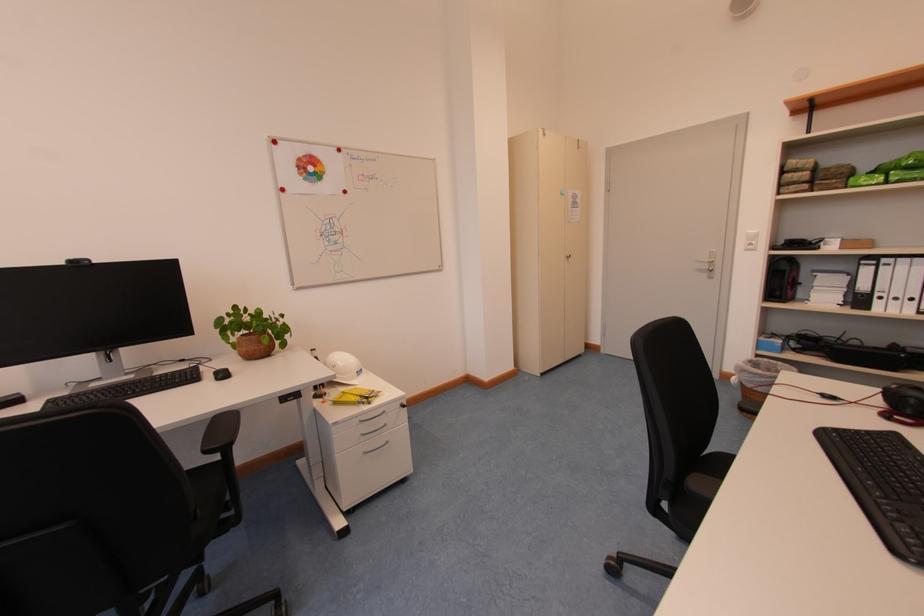
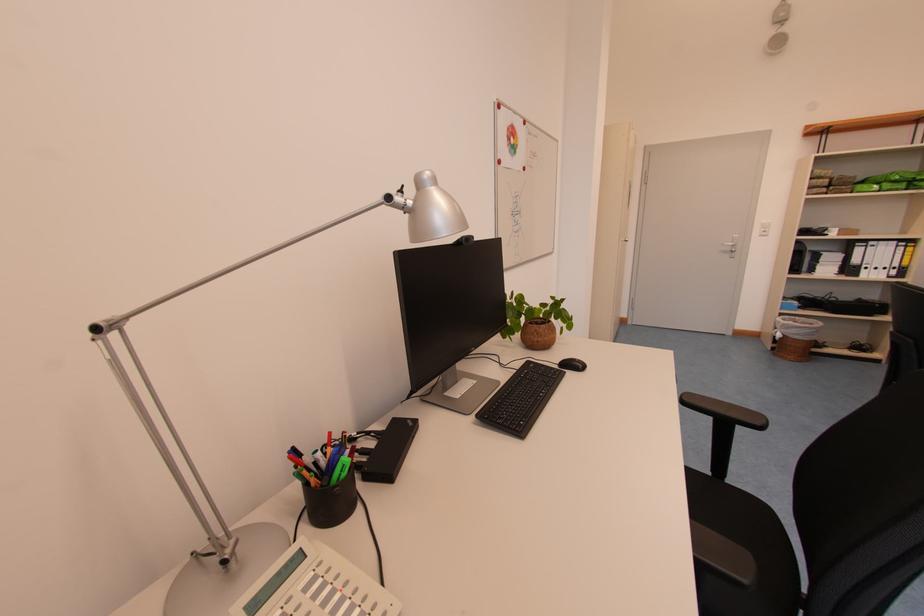
The point at (x=787, y=365) is marked in the first image. Where is the corresponding point in the second image?

(805, 321)